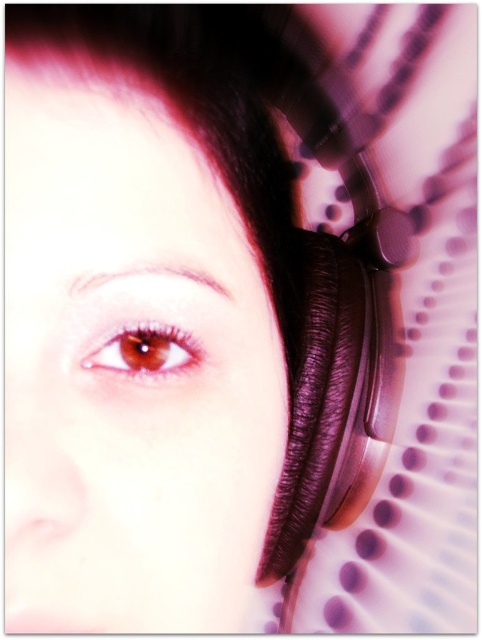
Does matte black headphones at right appear on the right side of satin brown earphone at right?

No, matte black headphones at right is not to the right of satin brown earphone at right.

Does point (112, 36) lie behind point (390, 371)?

No.

Between point (22, 595) and point (291, 561), which one is positioned in front?

Point (22, 595) is in front.

Where is `matte black headphones at right`? The width and height of the screenshot is (482, 640). matte black headphones at right is located at coordinates (138, 321).

Is satin brown earphone at right smaller than brown matte eye at center?

No.

What do you see at coordinates (331, 292) in the screenshot?
I see `satin brown earphone at right` at bounding box center [331, 292].

Is point (339, 234) positioned in front of point (174, 332)?

That is False.

Locate an element on the screen. satin brown earphone at right is located at coordinates (331, 292).

Between point (242, 138) and point (136, 371), which one is positioned in front?

Positioned in front is point (136, 371).

Does matte black headphones at right have a smaller size compared to brown matte eye at center?

Incorrect, matte black headphones at right is not smaller in size than brown matte eye at center.

What do you see at coordinates (138, 321) in the screenshot? I see `matte black headphones at right` at bounding box center [138, 321].

In order to click on matte black headphones at right in this screenshot , I will do `click(138, 321)`.